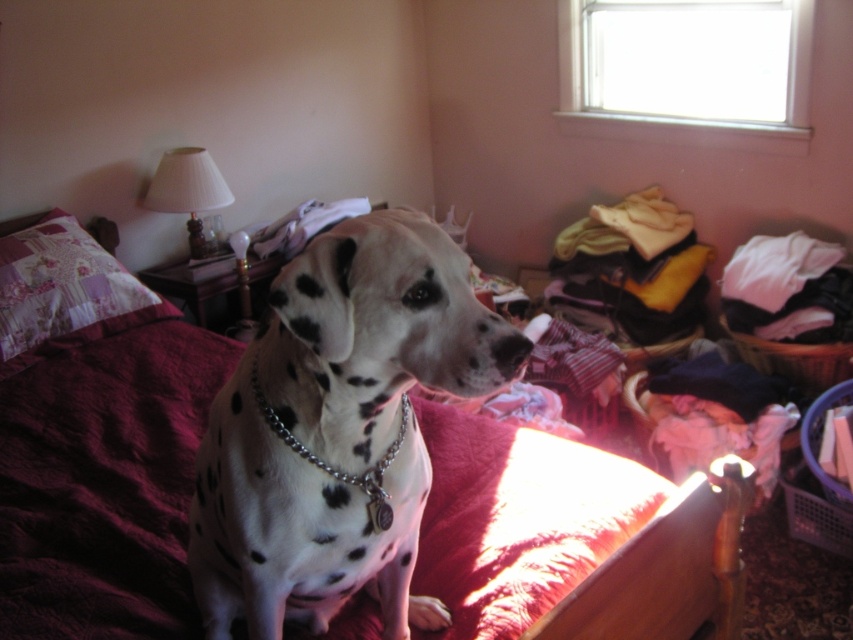
Question: From the image, what is the correct spatial relationship of patchwork fabric pillow at upper left in relation to metal chain at center?

Choices:
 (A) right
 (B) left

Answer: (B)

Question: Which point is farther to the camera?

Choices:
 (A) white-spotted fur at center
 (B) patchwork fabric pillow at upper left
 (C) metal chain at center

Answer: (B)

Question: Is white-spotted fur at center to the left of metal chain at center from the viewer's perspective?

Choices:
 (A) no
 (B) yes

Answer: (B)

Question: Which of the following is the closest to the observer?

Choices:
 (A) maroon quilted bed at center
 (B) patchwork fabric pillow at upper left
 (C) metal chain at center

Answer: (C)

Question: Is maroon quilted bed at center in front of metal chain at center?

Choices:
 (A) yes
 (B) no

Answer: (B)

Question: Based on their relative distances, which object is farther from the white-spotted fur at center?

Choices:
 (A) metal chain at center
 (B) maroon quilted bed at center
 (C) patchwork fabric pillow at upper left

Answer: (C)